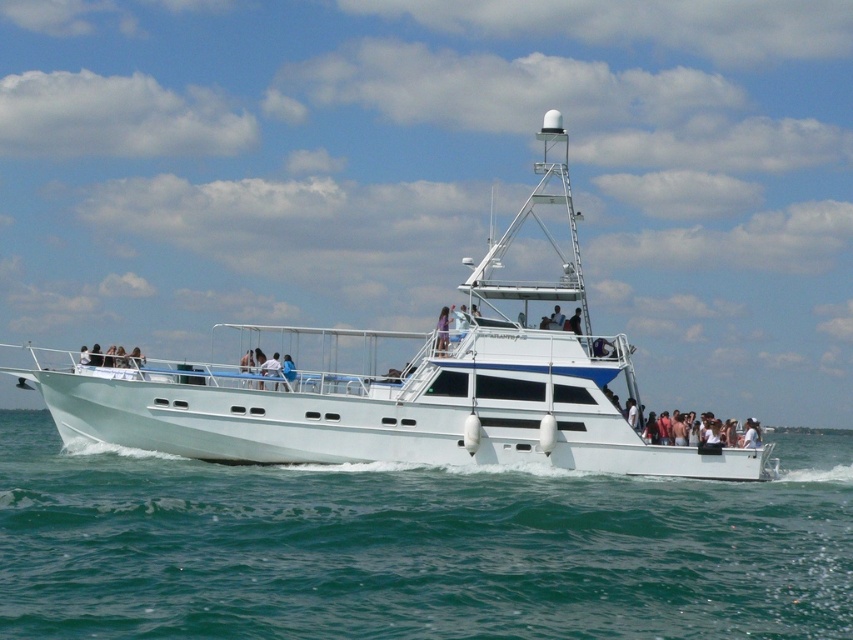
How much distance is there between white glossy boat at center and matte blue shirt at center?

They are 39.22 feet apart.

Is white glossy boat at center to the right of matte blue shirt at center from the viewer's perspective?

No, white glossy boat at center is not to the right of matte blue shirt at center.

Who is more distant from viewer, (355, 372) or (436, 323)?

The point (436, 323) is more distant.

Image resolution: width=853 pixels, height=640 pixels. I want to click on white glossy boat at center, so click(x=404, y=385).

Can you confirm if clear blue water at center is positioned to the right of white glossy boat at center?

Correct, you'll find clear blue water at center to the right of white glossy boat at center.

Is clear blue water at center below white glossy boat at center?

Yes.

Locate an element on the screen. The height and width of the screenshot is (640, 853). clear blue water at center is located at coordinates (415, 547).

Between point (268, 550) and point (437, 330), which one is positioned behind?

The point (437, 330) is more distant.

Which is in front, point (608, 532) or point (439, 316)?

Point (608, 532) is more forward.

Who is more distant from viewer, (64, 616) or (444, 330)?

Point (444, 330)

Identify the location of clear blue water at center. (415, 547).